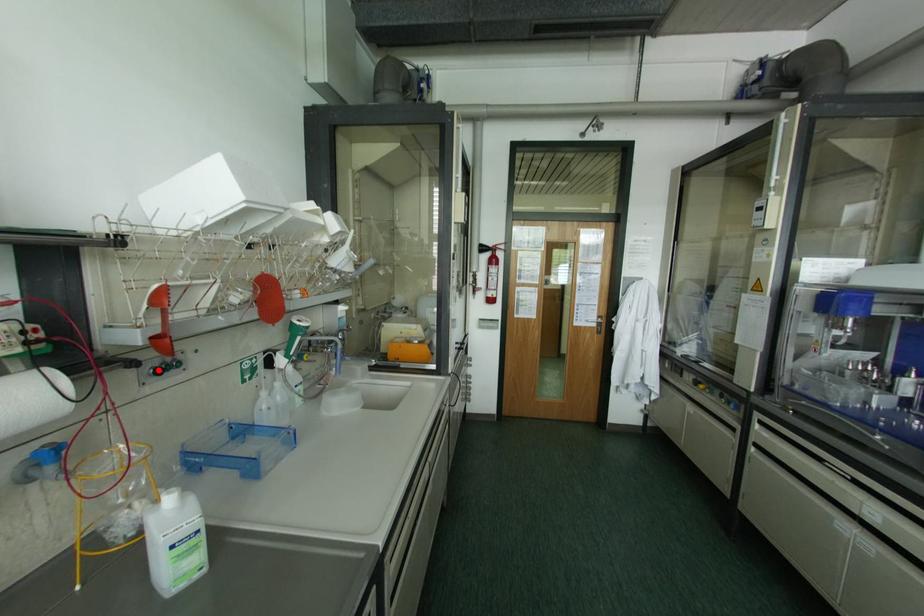
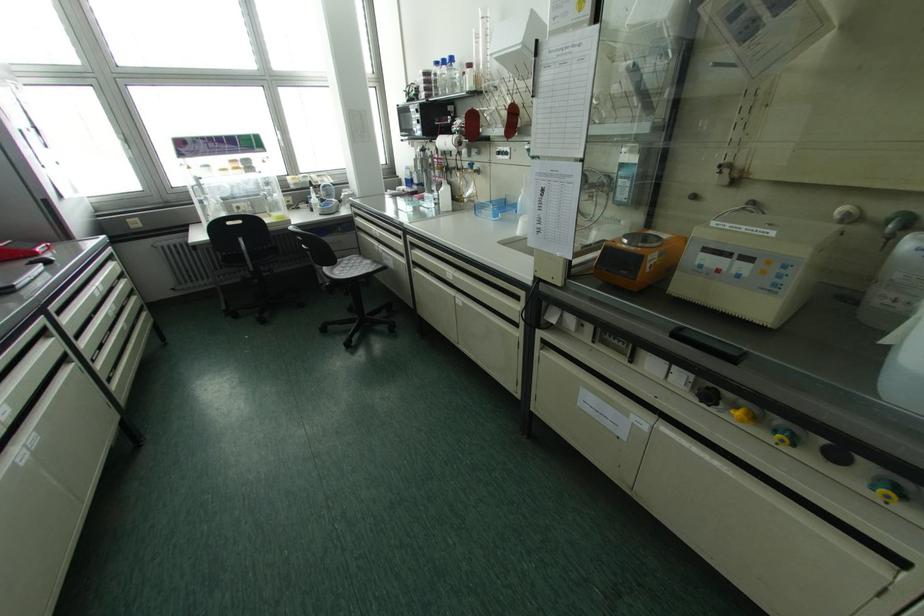
The point at the highlighted location is marked in the first image. Where is the corresponding point in the second image?

(497, 153)